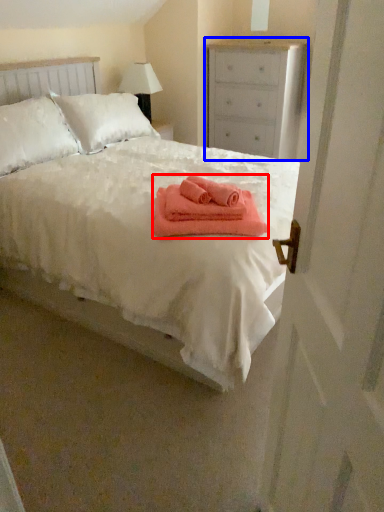
Question: Among these objects, which one is farthest to the camera, bath towel (highlighted by a red box) or chest of drawers (highlighted by a blue box)?

Choices:
 (A) bath towel
 (B) chest of drawers

Answer: (B)